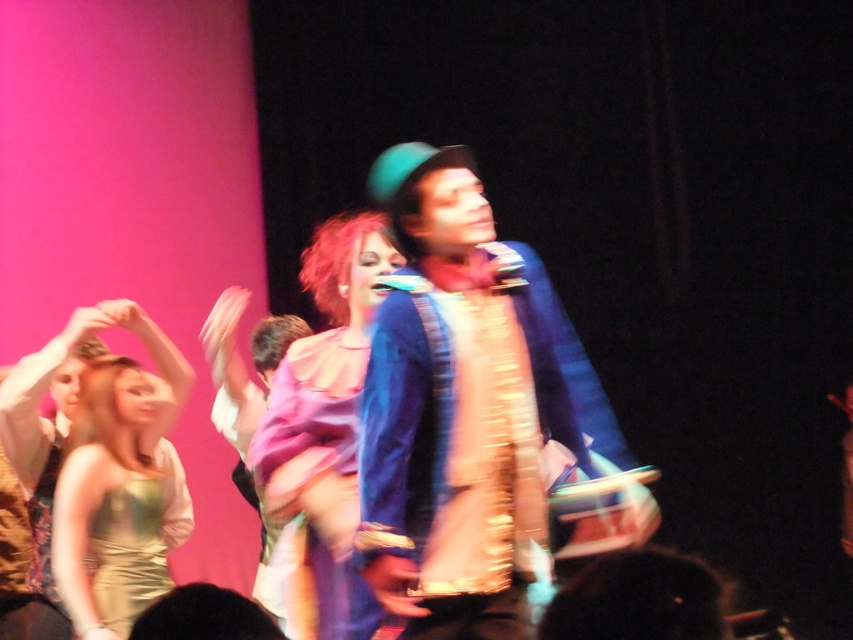
Question: Which point is closer to the camera?

Choices:
 (A) (293, 556)
 (B) (86, 371)

Answer: (A)

Question: Is matte pink dress at center to the right of gold sequined dress at lower left from the viewer's perspective?

Choices:
 (A) yes
 (B) no

Answer: (A)

Question: Is blue satin suit at center to the left of gold shiny dress at left from the viewer's perspective?

Choices:
 (A) no
 (B) yes

Answer: (A)

Question: Which of these objects is positioned closest to the gold shiny dress at left?

Choices:
 (A) gold sequined dress at lower left
 (B) blue satin suit at center

Answer: (A)

Question: Does gold shiny dress at left have a larger size compared to gold sequined dress at lower left?

Choices:
 (A) yes
 (B) no

Answer: (A)

Question: Which object is farther from the camera taking this photo?

Choices:
 (A) gold shiny dress at left
 (B) matte pink dress at center

Answer: (A)